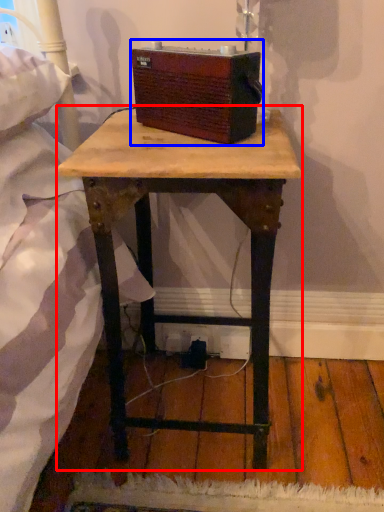
Question: Which object is closer to the camera taking this photo, table (highlighted by a red box) or box (highlighted by a blue box)?

Choices:
 (A) table
 (B) box

Answer: (A)